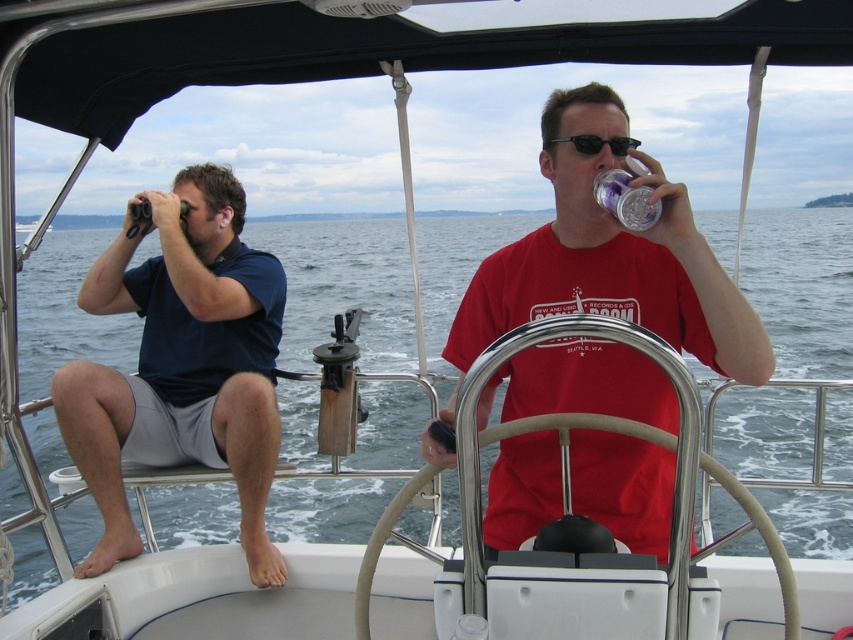
Is dark blue shirt at left to the left of black plastic sunglasses at upper center from the viewer's perspective?

Correct, you'll find dark blue shirt at left to the left of black plastic sunglasses at upper center.

Is dark blue shirt at left taller than black plastic sunglasses at upper center?

Indeed, dark blue shirt at left has a greater height compared to black plastic sunglasses at upper center.

Where is `dark blue shirt at left`? Image resolution: width=853 pixels, height=640 pixels. dark blue shirt at left is located at coordinates (183, 364).

Is dark blue shirt at left below clear plastic cup at upper right?

Correct, dark blue shirt at left is located below clear plastic cup at upper right.

Does point (251, 336) come farther from viewer compared to point (656, 212)?

Yes, it is.

Locate an element on the screen. Image resolution: width=853 pixels, height=640 pixels. dark blue shirt at left is located at coordinates (183, 364).

Does point (444, 456) come in front of point (236, 387)?

Yes, point (444, 456) is in front of point (236, 387).

Can you confirm if matte red t-shirt at center is positioned below dark blue shirt at left?

Actually, matte red t-shirt at center is above dark blue shirt at left.

Is point (616, 104) closer to camera compared to point (170, 355)?

Yes, point (616, 104) is in front of point (170, 355).

In order to click on matte red t-shirt at center in this screenshot , I will do `click(613, 275)`.